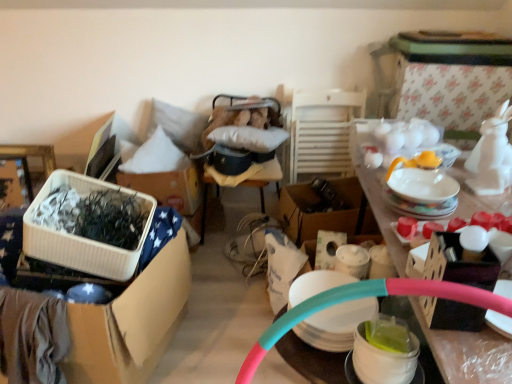
What do you see at coordinates (383, 361) in the screenshot? I see `white glossy bowl at lower right` at bounding box center [383, 361].

You are a GUI agent. You are given a task and a screenshot of the screen. Output one action in this format:
    pyautogui.click(x=<x>, y=<y>)
    Task: Click on the white wooden chair at center
    The width and height of the screenshot is (512, 384).
    Given the screenshot: What is the action you would take?
    pyautogui.click(x=323, y=131)

Image resolution: width=512 pixels, height=384 pixels. I want to click on white cardboard box at center, so click(169, 187).

Describe the element at coordinates (319, 210) in the screenshot. This screenshot has width=512, height=384. I see `cardboard box at center, which is the 2th box from left to right` at that location.

Where is `white glossy bowl at lower right`? Image resolution: width=512 pixels, height=384 pixels. white glossy bowl at lower right is located at coordinates pyautogui.click(x=383, y=361).

Based on their positions, is white soft pillow at upper left located to the left or right of white glossy table at upper right?

Clearly, white soft pillow at upper left is on the left of white glossy table at upper right in the image.

Is white soft pillow at upper left situated inside white glossy table at upper right or outside?

white soft pillow at upper left is not enclosed by white glossy table at upper right.

Can you confirm if white soft pillow at upper left is wider than white glossy table at upper right?

Incorrect, the width of white soft pillow at upper left does not surpass that of white glossy table at upper right.

From a real-world perspective, which object stands above the other?

In real-world perspective, white soft pillow at upper left is above.

Considering the positions of points (398, 378) and (403, 251), is point (398, 378) farther from camera compared to point (403, 251)?

No, it is not.

Is white glossy bowl at lower right oriented away from white glossy table at upper right?

Yes, white glossy bowl at lower right is facing away from white glossy table at upper right.

From the image's perspective, is white glossy bowl at lower right above or below white glossy table at upper right?

Based on their image positions, white glossy bowl at lower right is located above white glossy table at upper right.

Locate an element on the screen. The width and height of the screenshot is (512, 384). chair that appears behind the translucent plastic cups at center is located at coordinates (323, 131).

Is point (315, 130) closer or farther from the camera than point (328, 331)?

Point (315, 130) is farther from the camera than point (328, 331).

Is white wooden chair at center placed right next to translucent plastic cups at center?

They are not placed beside each other.

Is white wooden chair at center wider or thinner than translucent plastic cups at center?

Clearly, white wooden chair at center has less width compared to translucent plastic cups at center.

Is the depth of translucent plastic cups at center less than that of white cardboard box at center?

Yes, it is in front of white cardboard box at center.

From a real-world perspective, which object stands above the other?

translucent plastic cups at center is physically above.

Where is `tableware below the white cardboard box at center (from the image's perspective)`? The image size is (512, 384). tableware below the white cardboard box at center (from the image's perspective) is located at coordinates (336, 324).

Are translucent plastic cups at center and white cardboard box at center making contact?

There is a gap between translucent plastic cups at center and white cardboard box at center.

From a real-world perspective, between white plastic container at left, which is counted as the 1th box, starting from the front, and white soft pillow at upper left, who is vertically lower?

white plastic container at left, which is counted as the 1th box, starting from the front, is physically lower.

Is white plastic container at left, arranged as the 2th box when viewed from the back, completely or partially outside of white soft pillow at upper left?

Indeed, white plastic container at left, arranged as the 2th box when viewed from the back, is completely outside white soft pillow at upper left.

Can you see white plastic container at left, which is counted as the 2th box, starting from the right, touching white soft pillow at upper left?

No, white plastic container at left, which is counted as the 2th box, starting from the right, is not next to white soft pillow at upper left.

From the image's perspective, is white plastic container at left, arranged as the 2th box when viewed from the back, on white soft pillow at upper left?

No.

From the image's perspective, between white glossy bowl at lower right and white soft pillow at upper left, who is located below?

white glossy bowl at lower right is shown below in the image.

From a real-world perspective, is white glossy bowl at lower right positioned under white soft pillow at upper left based on gravity?

No.

Is white glossy bowl at lower right oriented away from white soft pillow at upper left?

No, white glossy bowl at lower right is not facing away from white soft pillow at upper left.

Considering the points (377, 367) and (111, 308), which point is behind, point (377, 367) or point (111, 308)?

Point (111, 308)

Is white glossy bowl at lower right next to white plastic container at left, which is counted as the 2th box, starting from the right, and touching it?

No, white glossy bowl at lower right is not in contact with white plastic container at left, which is counted as the 2th box, starting from the right.

Can you tell me how much white glossy bowl at lower right and white plastic container at left, which is counted as the 2th box, starting from the right, differ in facing direction?

The angle between the facing direction of white glossy bowl at lower right and the facing direction of white plastic container at left, which is counted as the 2th box, starting from the right, is 77.4 degrees.

In terms of width, does white glossy bowl at lower right look wider or thinner when compared to white plastic container at left, the first box from the left?

white glossy bowl at lower right is thinner than white plastic container at left, the first box from the left.

At what (x,y) coordinates should I click in order to perform the action: click on desk on the right side of white soft pillow at upper left. Please return your answer as a coordinate pair (x, y). Looking at the image, I should click on (467, 353).

The image size is (512, 384). What are the coordinates of `bowl that appears above the white glossy table at upper right (from a real-world perspective)` in the screenshot? It's located at (383, 361).

Based on their spatial positions, is white wooden chair at center or translucent plastic cups at center closer to white plastic container at left, which is counted as the 1th box, starting from the front?

translucent plastic cups at center.

Which object lies further to the anchor point white wooden chair at center, cardboard box at center, which is the 2th box from left to right, or white plastic container at left, arranged as the 2th box when viewed from the back?

Among the two, white plastic container at left, arranged as the 2th box when viewed from the back, is located further to white wooden chair at center.

Considering their positions, is white glossy table at upper right positioned further to white soft pillow at upper left than white glossy bowl at lower right?

The object further to white soft pillow at upper left is white glossy bowl at lower right.

Which object lies nearer to the anchor point white glossy table at upper right, white glossy bowl at lower right or cardboard box at center, placed as the first box when sorted from back to front?

white glossy bowl at lower right lies closer to white glossy table at upper right than the other object.

When comparing their distances from white glossy table at upper right, does white soft pillow at upper left or white wooden chair at center seem further?

white soft pillow at upper left lies further to white glossy table at upper right than the other object.

Which object lies further to the anchor point white glossy bowl at lower right, white soft pillow at upper left or translucent plastic cups at center?

white soft pillow at upper left.

Based on their spatial positions, is cardboard box at center, placed as the first box when sorted from back to front, or white soft pillow at upper left further from white glossy bowl at lower right?

white soft pillow at upper left is positioned further to the anchor white glossy bowl at lower right.

Considering their positions, is white plastic container at left, arranged as the 2th box when viewed from the back, positioned further to white glossy table at upper right than white cardboard box at center?

white cardboard box at center lies further to white glossy table at upper right than the other object.

You are a GUI agent. You are given a task and a screenshot of the screen. Output one action in this format:
    pyautogui.click(x=<x>, y=<y>)
    Task: Click on the tableware located between white plastic container at left, arranged as the 2th box when viewed from the back, and white glossy bowl at lower right in the left-right direction
    This screenshot has height=384, width=512.
    Given the screenshot: What is the action you would take?
    pyautogui.click(x=336, y=324)

The image size is (512, 384). Identify the location of pillow located between white glossy table at upper right and cardboard box at center, the 2th box viewed from the front, in the depth direction. (156, 156).

Locate an element on the screen. The height and width of the screenshot is (384, 512). box between white glossy bowl at lower right and cardboard box at center, which is the 2th box from left to right, in the front-back direction is located at coordinates pos(132,317).

The height and width of the screenshot is (384, 512). Identify the location of box between white glossy bowl at lower right and white soft pillow at upper left along the z-axis. (132, 317).